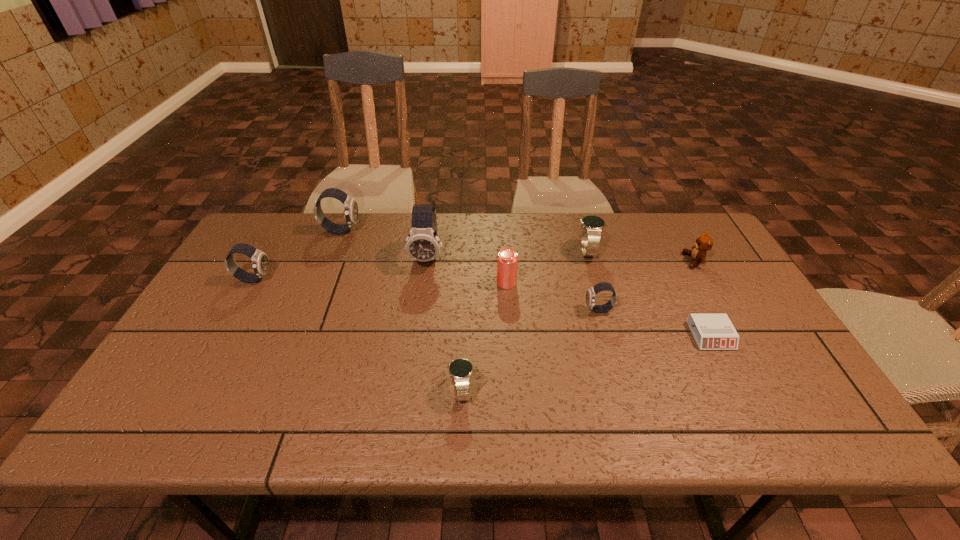
Where is `vacant space at the near right corner of the desktop`? This screenshot has height=540, width=960. vacant space at the near right corner of the desktop is located at coordinates (766, 406).

Where is `free space between the nearest object and the smallest dark watch`? Image resolution: width=960 pixels, height=540 pixels. free space between the nearest object and the smallest dark watch is located at coordinates (x=530, y=350).

This screenshot has height=540, width=960. I want to click on vacant area between the fifth object from right to left and the second smallest dark watch, so click(x=380, y=281).

Where is `empty location between the farther blue watch and the brown teddy bear`? This screenshot has width=960, height=540. empty location between the farther blue watch and the brown teddy bear is located at coordinates (640, 256).

Where is `empty space between the left blue watch and the tallest watch`? This screenshot has width=960, height=540. empty space between the left blue watch and the tallest watch is located at coordinates (444, 324).

Locate an element on the screen. This screenshot has height=540, width=960. free area in between the seventh object from right to left and the leftmost watch is located at coordinates (341, 268).

Find the location of a particular element. vacant space that's between the second smallest dark watch and the second tallest object is located at coordinates (298, 255).

Locate an element on the screen. Image resolution: width=960 pixels, height=540 pixels. vacant space that is in between the brown teddy bear and the tallest object is located at coordinates (561, 259).

Where is `free space between the beer can and the right blue watch`? Image resolution: width=960 pixels, height=540 pixels. free space between the beer can and the right blue watch is located at coordinates (547, 267).

Select which object appears as the closest to the seventh farthest object. Please provide its 2D coordinates. Your answer should be formatted as a tuple, i.e. [(x, y)], where the tuple contains the x and y coordinates of a point satisfying the conditions above.

[(592, 226)]